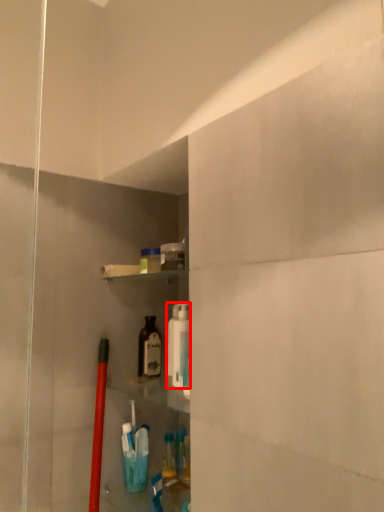
Question: From the image's perspective, considering the relative positions of cleaning product (annotated by the red box) and bottle in the image provided, where is cleaning product (annotated by the red box) located with respect to the staircase?

Choices:
 (A) above
 (B) below

Answer: (A)